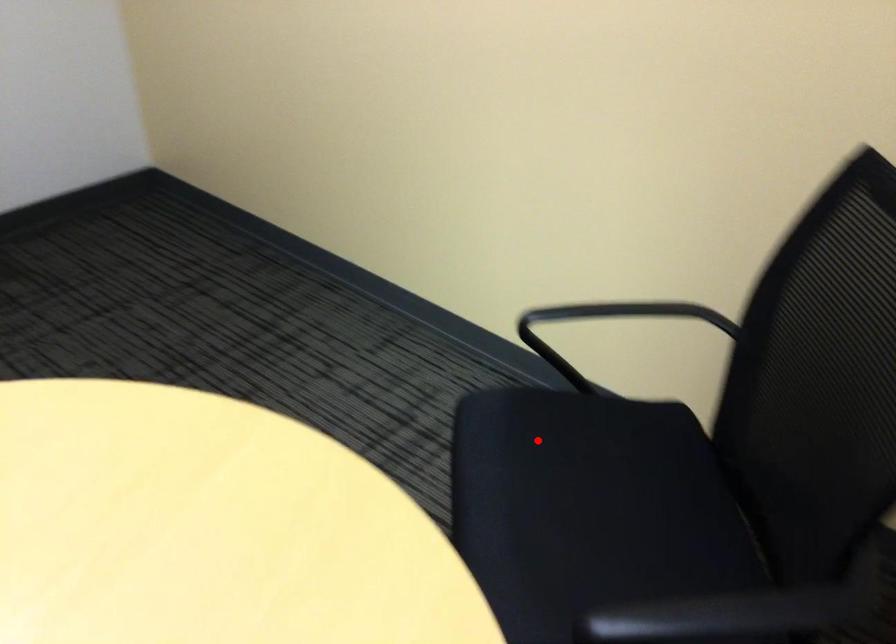
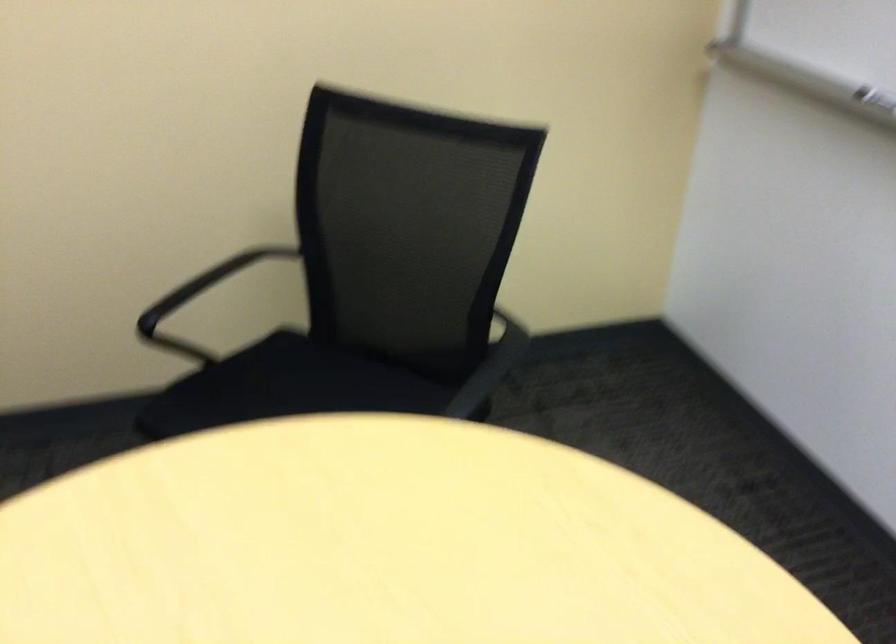
Question: I am providing you with two images of the same scene from different viewpoints. A red point is marked on the first image. Is the red point's position out of view in image 2?

Choices:
 (A) Yes
 (B) No

Answer: (B)